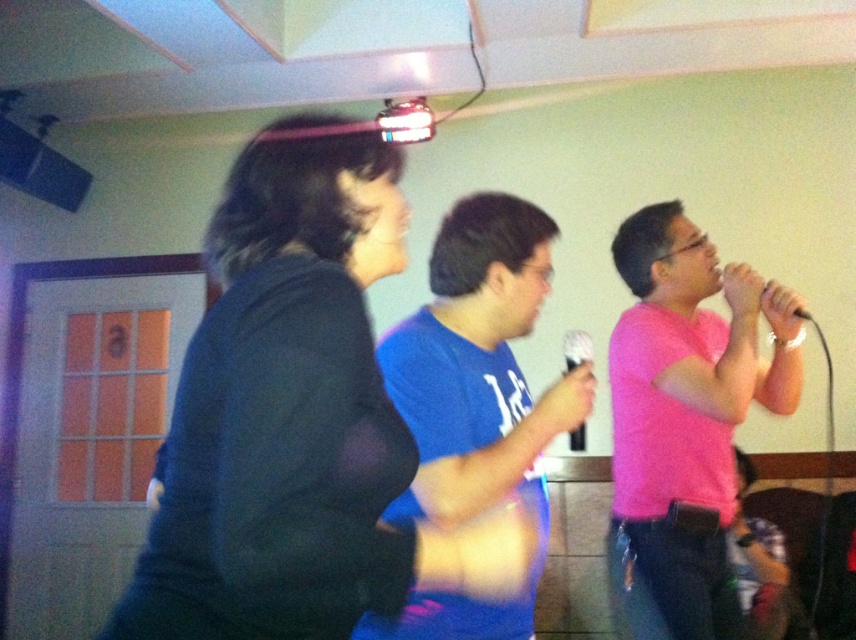
Question: Among these points, which one is farthest from the camera?

Choices:
 (A) (702, 400)
 (B) (727, 272)
 (C) (248, 544)

Answer: (B)

Question: Which of the following is the farthest from the observer?

Choices:
 (A) (723, 272)
 (B) (462, 429)

Answer: (A)

Question: Among these points, which one is nearest to the camera?

Choices:
 (A) (577, 426)
 (B) (409, 637)

Answer: (B)

Question: Does black matte shirt at upper left appear under matte black microphone at upper right?

Choices:
 (A) no
 (B) yes

Answer: (B)

Question: Does black matte shirt at upper left lie behind pink matte shirt at center?

Choices:
 (A) no
 (B) yes

Answer: (A)

Question: Can you confirm if blue cotton shirt at center is positioned above black plastic microphone at center?

Choices:
 (A) no
 (B) yes

Answer: (A)